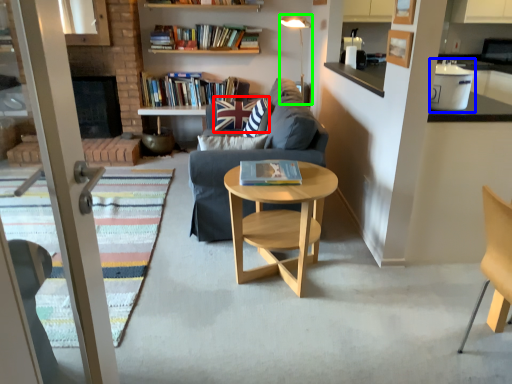
Question: Which is nearer to the pillow (highlighted by a red box)? appliance (highlighted by a blue box) or lamp (highlighted by a green box).

Choices:
 (A) appliance
 (B) lamp

Answer: (B)